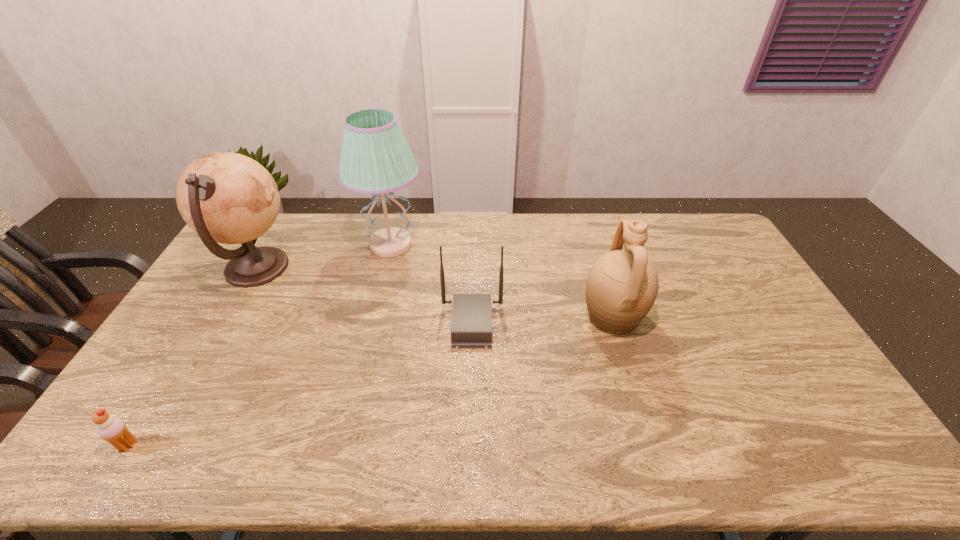
This screenshot has height=540, width=960. Find the location of `unoccupied area between the third object from left to right and the shortest object`. unoccupied area between the third object from left to right and the shortest object is located at coordinates 259,345.

Where is `object that stands as the third closest to the nearest object`? object that stands as the third closest to the nearest object is located at coordinates (471, 325).

Where is `the fourth closest object to the third shortest object`? The width and height of the screenshot is (960, 540). the fourth closest object to the third shortest object is located at coordinates (112, 429).

Identify the location of free space that satisfies the following two spatial constraints: 1. on the back of the router to connect cables; 2. at the front with a straw on the icecream. Image resolution: width=960 pixels, height=540 pixels. (469, 445).

Where is `free space that satisfies the following two spatial constraints: 1. on the back of the second shortest object to connect cables; 2. at the front with a straw on the icecream`? The height and width of the screenshot is (540, 960). free space that satisfies the following two spatial constraints: 1. on the back of the second shortest object to connect cables; 2. at the front with a straw on the icecream is located at coordinates (469, 445).

Locate an element on the screen. The image size is (960, 540). vacant space that satisfies the following two spatial constraints: 1. on the back of the second object from right to left to connect cables; 2. at the front with a straw on the shortest object is located at coordinates (469, 445).

Identify the location of vacant space that satisfies the following two spatial constraints: 1. on the front-facing side of the globe; 2. at the front with a straw on the shortest object. (156, 445).